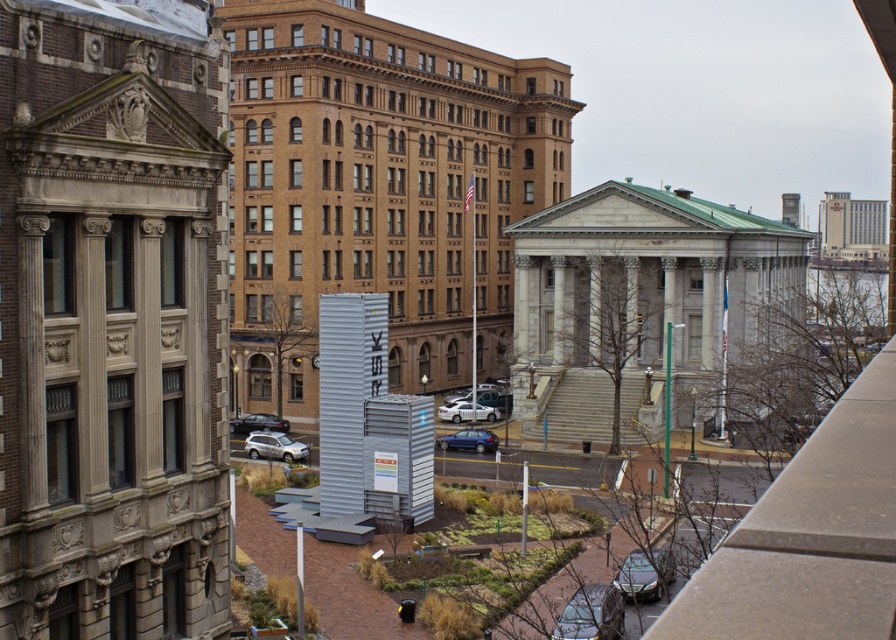
Is white corrugated metal container at center closer to the viewer compared to shiny black car at lower right?

No, it is behind shiny black car at lower right.

Which is behind, point (324, 179) or point (656, 595)?

Point (324, 179)

The height and width of the screenshot is (640, 896). What do you see at coordinates (377, 189) in the screenshot?
I see `white corrugated metal container at center` at bounding box center [377, 189].

Find the location of `white corrugated metal container at center`. white corrugated metal container at center is located at coordinates (377, 189).

Based on the photo, is white matte car at center taller than shiny black car at lower left?

Incorrect, white matte car at center's height is not larger of shiny black car at lower left's.

Is white matte car at center wider than shiny black car at lower left?

Incorrect, white matte car at center's width does not surpass shiny black car at lower left's.

Does point (463, 404) come in front of point (257, 422)?

No, it is behind (257, 422).

Where is `white matte car at center`? The width and height of the screenshot is (896, 640). white matte car at center is located at coordinates (455, 410).

Is gray metallic tower at left wider than metallic silver car at lower center?

Indeed, gray metallic tower at left has a greater width compared to metallic silver car at lower center.

Who is higher up, gray metallic tower at left or metallic silver car at lower center?

gray metallic tower at left is above.

Between point (214, 508) and point (590, 595), which one is positioned in front?

Point (214, 508) is in front.

Image resolution: width=896 pixels, height=640 pixels. Identify the location of gray metallic tower at left. (112, 320).